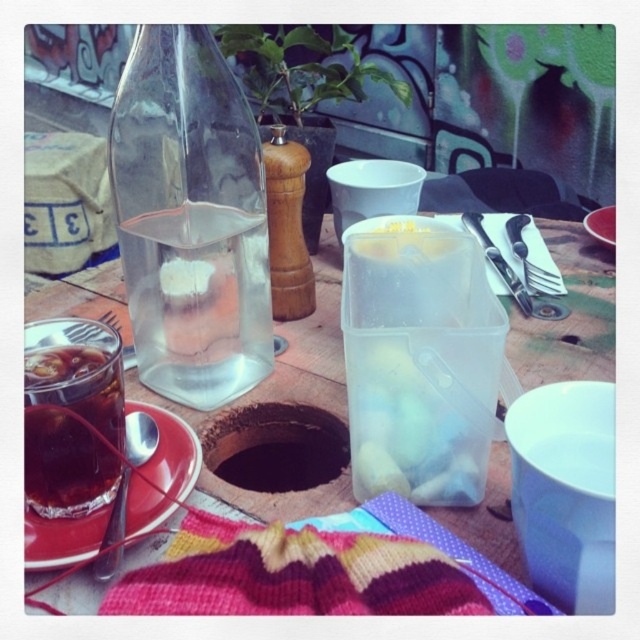
You are setting up a picnic and need to place a 35 cm long bottle of wine between the transparent glass bottle at center and another object. Can you fit it there?

The distance between the transparent glass bottle at center and the other object is 34.25 centimeters, so the 35 cm bottle would not fit as it is slightly longer than the available space.

You are setting up a picnic and need to place a small vase between the transparent glass bottle at center and the shiny metal knife at upper right. Based on their positions, where should you place the vase?

The transparent glass bottle at center is below the shiny metal knife at upper right, so you should place the vase between them vertically, positioning it below the knife and above the bottle to maintain their spatial relationship.